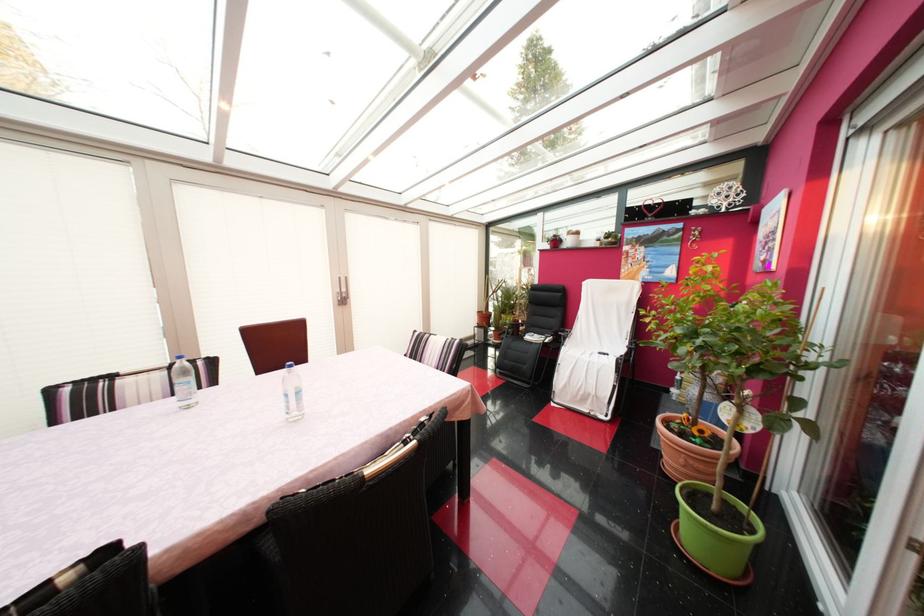
Image resolution: width=924 pixels, height=616 pixels. In order to click on terracotta plant pot in this screenshot , I will do `click(688, 453)`.